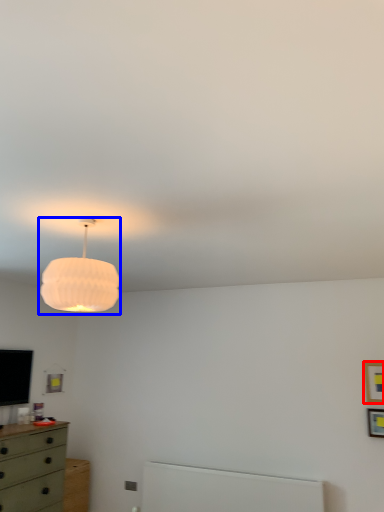
Question: Which object is closer to the camera taking this photo, picture frame (highlighted by a red box) or lamp (highlighted by a blue box)?

Choices:
 (A) picture frame
 (B) lamp

Answer: (B)